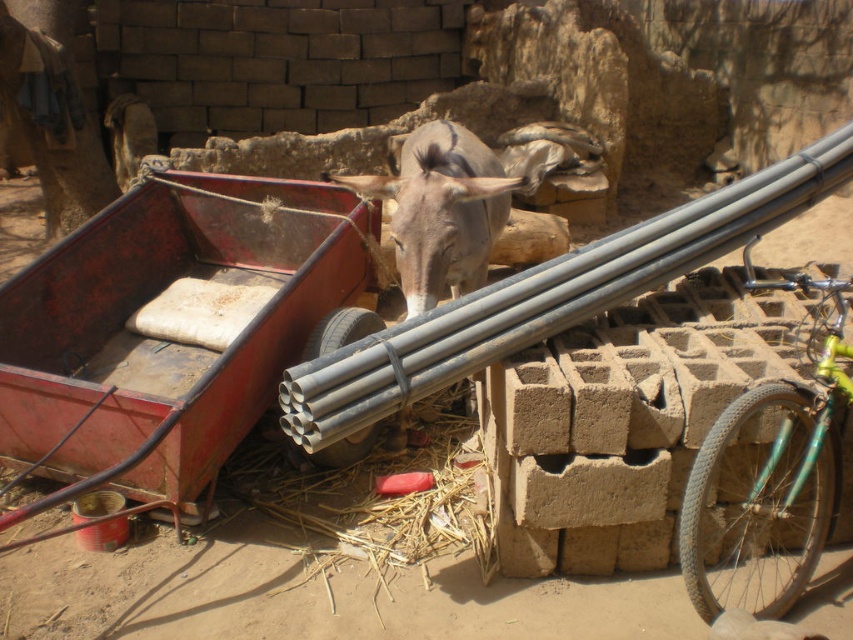
You are standing in front of the red metal cart with pipes. You want to reach the green matte bicycle at right without moving the cart. Is the bicycle within your immediate reach?

The green matte bicycle at right is 2.74 meters away from you, so it is not within immediate reach without moving towards it.

You are standing in front of the red metal cart and looking at two points marked in the image. Which point, point 1 at coordinates (782, 605) or point 2 at coordinates (372, 180), is closer to you?

Point 1 at coordinates (782, 605) is closer to you than point 2 at coordinates (372, 180).

You are a farmer standing next to the gray matte donkey at center and need to reach the green matte bicycle at right to retrieve a tool. Can you walk directly to the bicycle without moving the donkey?

The green matte bicycle at right and gray matte donkey at center are 4.30 feet apart from each other. Since the distance is sufficient, you can walk directly to the bicycle without moving the donkey.